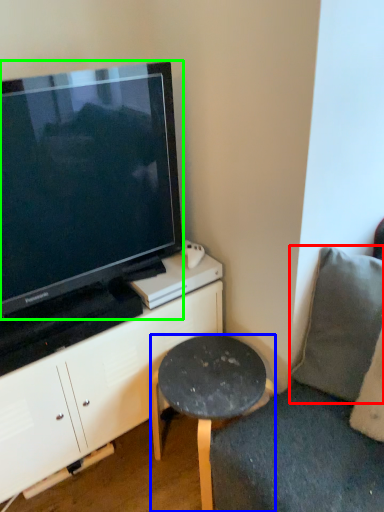
Question: Considering the real-world distances, which object is closest to pillow (highlighted by a red box)? stool (highlighted by a blue box) or television (highlighted by a green box).

Choices:
 (A) stool
 (B) television

Answer: (A)